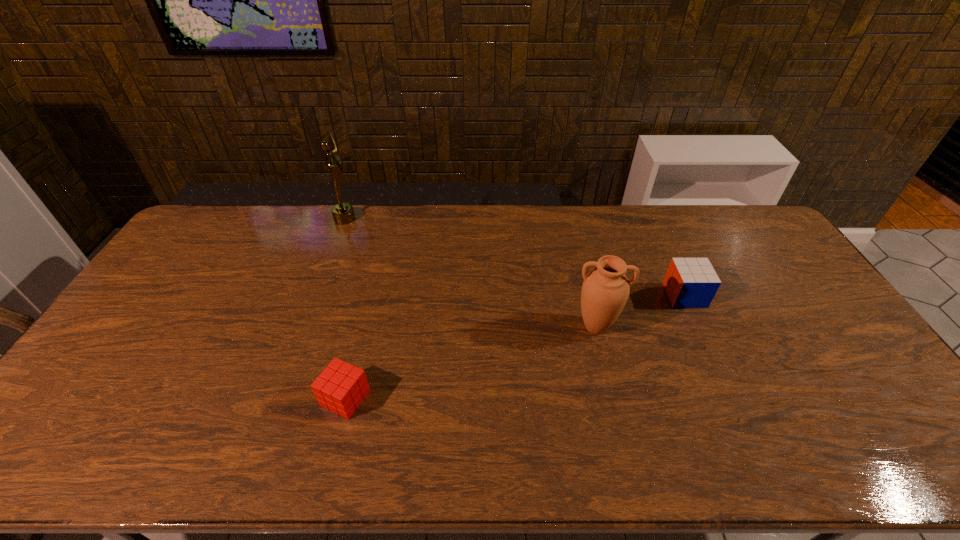
Locate an element on the screen. free space between the third nearest object and the leftmost object is located at coordinates (515, 257).

Locate an element on the screen. The width and height of the screenshot is (960, 540). empty space between the farthest object and the farther cube is located at coordinates (515, 257).

The height and width of the screenshot is (540, 960). I want to click on free space between the third object from left to right and the farthest object, so click(470, 273).

Identify the location of vacant area that lies between the second object from right to left and the second object from left to right. Image resolution: width=960 pixels, height=540 pixels. (470, 362).

Locate an element on the screen. free space between the award and the third shortest object is located at coordinates (470, 273).

Image resolution: width=960 pixels, height=540 pixels. Identify the location of unoccupied position between the award and the left cube. (345, 308).

I want to click on empty space between the third object from left to right and the award, so click(x=470, y=273).

Identify the location of unoccupied position between the nearer cube and the leftmost object. (345, 308).

Find the location of a particular element. The image size is (960, 540). object that is the second nearest to the urn is located at coordinates (341, 387).

At what (x,y) coordinates should I click in order to perform the action: click on object that is the second closest one to the farther cube. Please return your answer as a coordinate pair (x, y). Looking at the image, I should click on (341, 387).